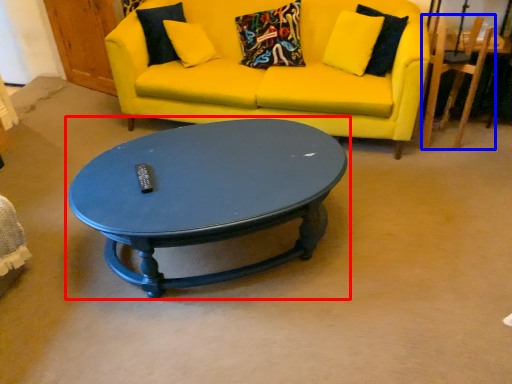
Question: Which object is further to the camera taking this photo, coffee table (highlighted by a red box) or armchair (highlighted by a blue box)?

Choices:
 (A) coffee table
 (B) armchair

Answer: (B)